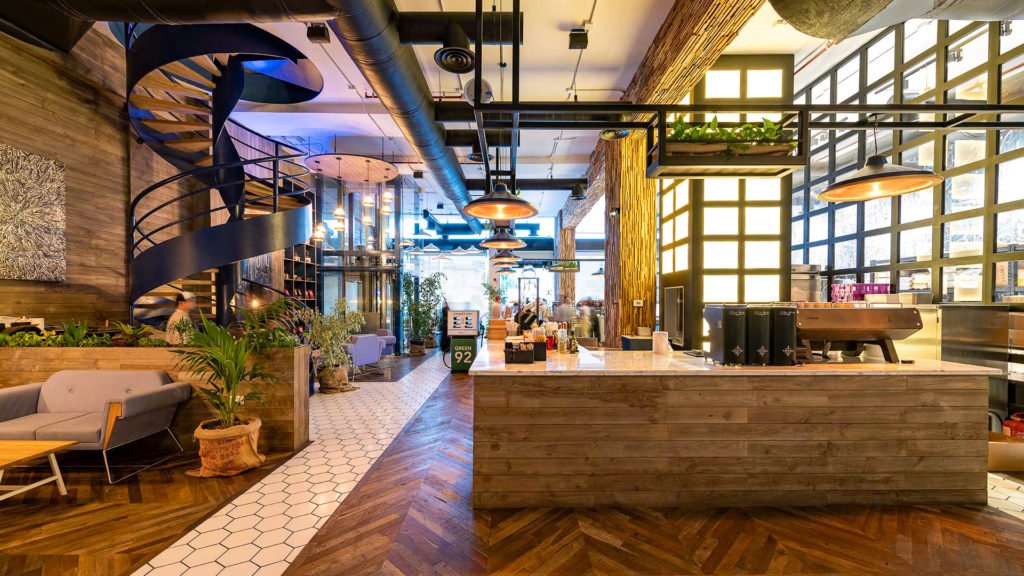
Where is `display shelves`? display shelves is located at coordinates (292, 250), (301, 250), (315, 250), (314, 269), (298, 274), (289, 274), (289, 284), (298, 289), (311, 290), (312, 303).